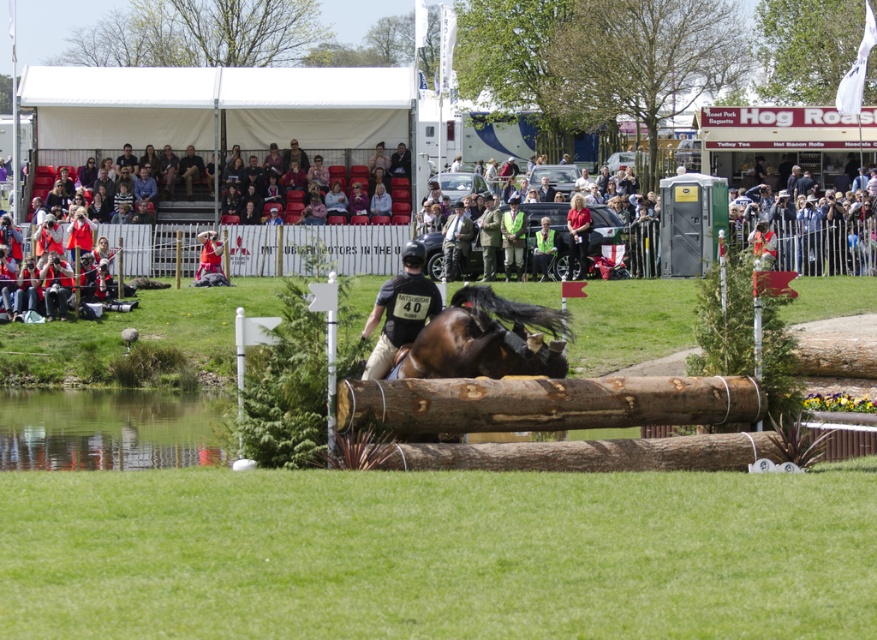
Between natural wood log at center and brown glossy horse at center, which one has less height?

natural wood log at center

Can you confirm if natural wood log at center is taller than brown glossy horse at center?

No, natural wood log at center is not taller than brown glossy horse at center.

Does point (629, 400) come in front of point (555, 342)?

Yes, it is.

You are a GUI agent. You are given a task and a screenshot of the screen. Output one action in this format:
    pyautogui.click(x=<x>, y=<y>)
    Task: Click on the natural wood log at center
    
    Given the screenshot: What is the action you would take?
    click(x=545, y=403)

Who is more distant from viewer, (x=457, y=324) or (x=362, y=374)?

Positioned behind is point (x=362, y=374).

Who is positioned more to the left, brown glossy horse at center or black matte shirt at center?

From the viewer's perspective, black matte shirt at center appears more on the left side.

Identify the location of brown glossy horse at center. (479, 339).

This screenshot has width=877, height=640. I want to click on brown glossy horse at center, so 479,339.

Does natural wood log at center appear on the right side of black matte shirt at center?

Correct, you'll find natural wood log at center to the right of black matte shirt at center.

Between point (674, 419) and point (415, 275), which one is positioned in front?

Point (674, 419) is more forward.

Image resolution: width=877 pixels, height=640 pixels. I want to click on natural wood log at center, so click(x=545, y=403).